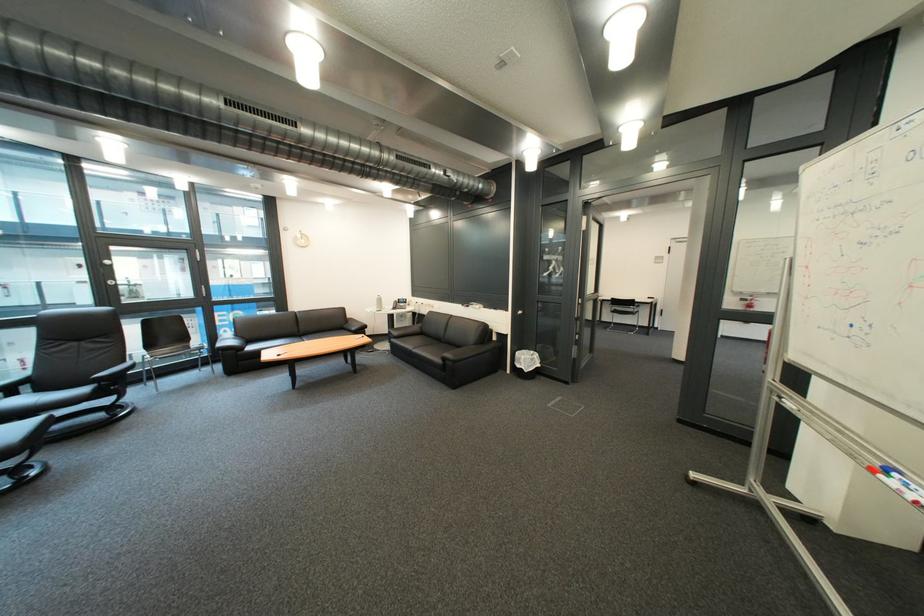
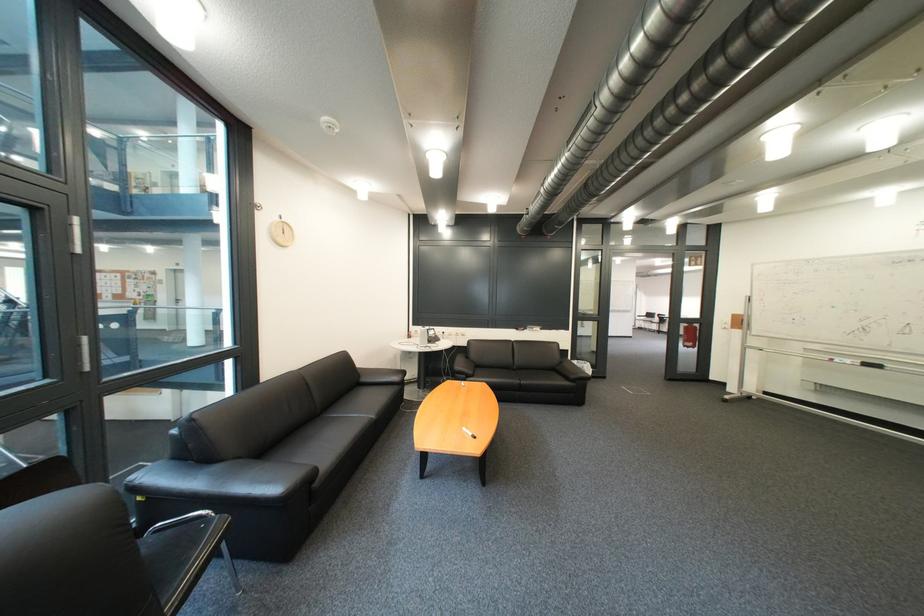
Question: I am providing you with two images of the same scene from different viewpoints. Please identify which objects are invisible in image2.

Choices:
 (A) red whiteboard marker
 (B) black door handle
 (C) chair sitting surface
 (D) red drinking cup

Answer: (C)